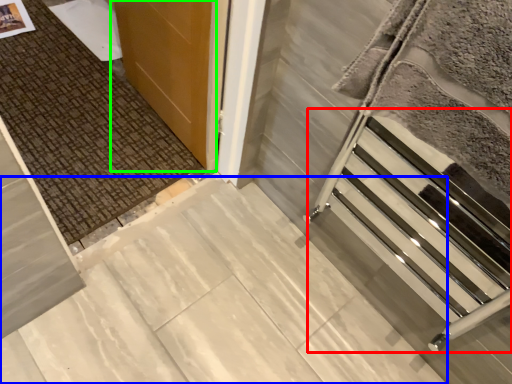
Question: Which is farther away from stairwell (highlighted by a red box)? concrete (highlighted by a blue box) or door (highlighted by a green box)?

Choices:
 (A) concrete
 (B) door

Answer: (B)